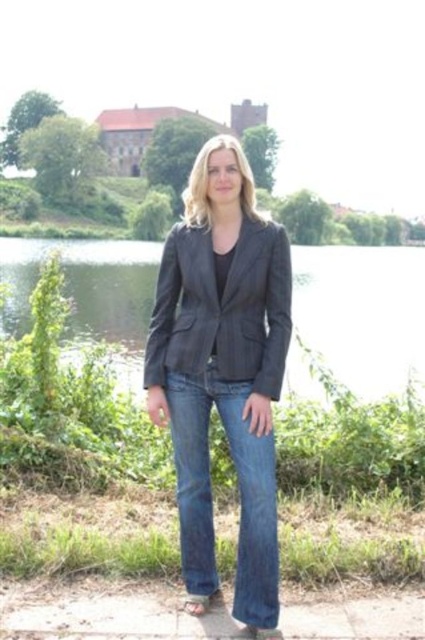
Question: Which of the following is the closest to the observer?

Choices:
 (A) (266, 237)
 (B) (232, 314)

Answer: (B)

Question: Can you confirm if matte black blazer at center is positioned to the right of denim jeans at center?

Choices:
 (A) no
 (B) yes

Answer: (A)

Question: Is matte black blazer at center smaller than denim jeans at center?

Choices:
 (A) yes
 (B) no

Answer: (B)

Question: Does matte black blazer at center lie in front of denim jeans at center?

Choices:
 (A) yes
 (B) no

Answer: (B)

Question: Which point is closer to the camera?

Choices:
 (A) (169, 282)
 (B) (274, 476)

Answer: (B)

Question: Which object appears closest to the camera in this image?

Choices:
 (A) brown leather sandal at lower center
 (B) dark gray pinstripe blazer at center

Answer: (A)